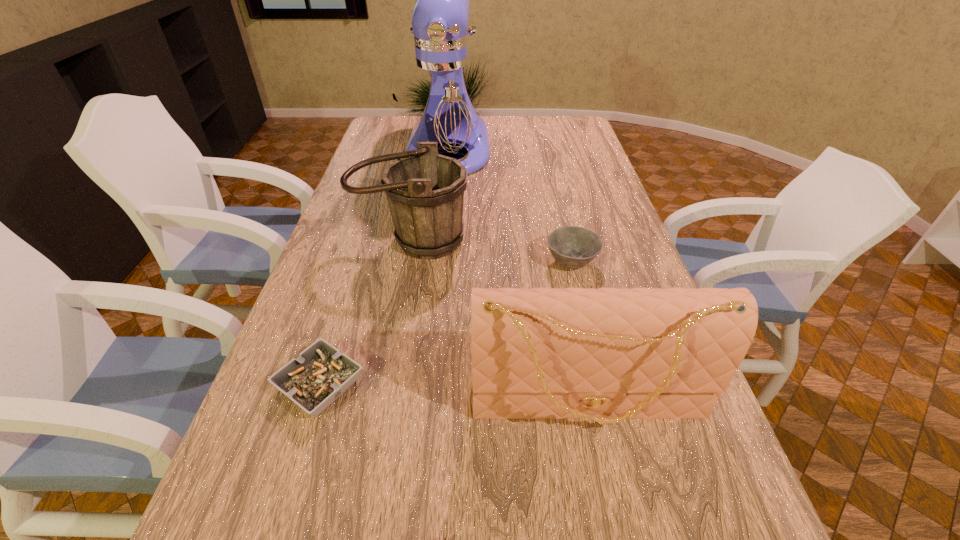
Where is `the farthest object`? The width and height of the screenshot is (960, 540). the farthest object is located at coordinates (442, 98).

Locate an element on the screen. the tallest object is located at coordinates (442, 98).

Where is `handbag`? The image size is (960, 540). handbag is located at coordinates (608, 354).

The image size is (960, 540). Identify the location of bucket. (425, 190).

I want to click on the fourth tallest object, so click(x=573, y=247).

Where is `ashtray`? This screenshot has width=960, height=540. ashtray is located at coordinates (320, 374).

The image size is (960, 540). Find the location of `vacant space situated 0.210m at the mixing area of the farthest object`. vacant space situated 0.210m at the mixing area of the farthest object is located at coordinates (440, 219).

You are a GUI agent. You are given a task and a screenshot of the screen. Output one action in this format:
    pyautogui.click(x=<x>, y=<y>)
    Task: Click on the blank area located on the front-facing side of the handbag
    The height and width of the screenshot is (540, 960).
    Given the screenshot: What is the action you would take?
    pyautogui.click(x=605, y=488)

Image resolution: width=960 pixels, height=540 pixels. In order to click on free space located 0.250m on the handle side of the bucket in this screenshot , I will do `click(394, 333)`.

Find the location of a particular element. This screenshot has height=540, width=960. free region located 0.070m on the front of the second shortest object is located at coordinates (580, 298).